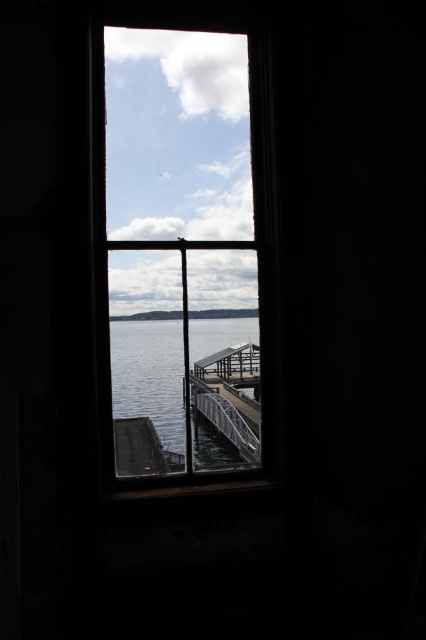
Question: Is wooden frame at center wider than clear water at center?

Choices:
 (A) no
 (B) yes

Answer: (B)

Question: Is wooden frame at center positioned in front of metallic gray rail at center?

Choices:
 (A) no
 (B) yes

Answer: (B)

Question: Which object appears farthest from the camera in this image?

Choices:
 (A) metallic gray dock at center
 (B) metallic gray rail at center
 (C) wooden frame at center
 (D) clear water at center

Answer: (B)

Question: Which object appears farthest from the camera in this image?

Choices:
 (A) wooden frame at center
 (B) clear water at center
 (C) metallic gray rail at center

Answer: (C)

Question: Does wooden frame at center appear under clear water at center?

Choices:
 (A) no
 (B) yes

Answer: (A)

Question: Which is farther from the wooden frame at center?

Choices:
 (A) metallic gray rail at center
 (B) clear water at center
 (C) metallic gray dock at center

Answer: (A)